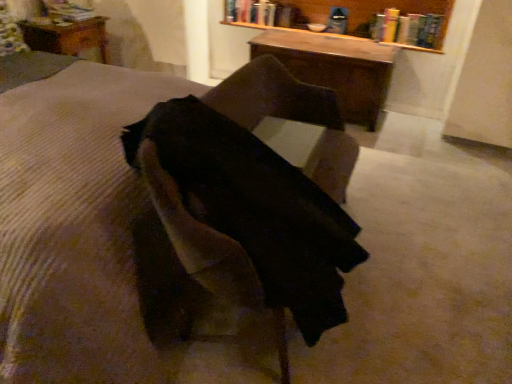
You are a GUI agent. You are given a task and a screenshot of the screen. Output one action in this format:
    pyautogui.click(x=<x>, y=<y>)
    Task: Click on the black fabric at center, the 2th table viewed from the left
    The width and height of the screenshot is (512, 384).
    Given the screenshot: What is the action you would take?
    pyautogui.click(x=313, y=152)

This screenshot has width=512, height=384. What do you see at coordinates (313, 152) in the screenshot?
I see `black fabric at center, acting as the 2th table starting from the right` at bounding box center [313, 152].

What do you see at coordinates (335, 68) in the screenshot?
I see `wooden table at center, which is the 2th table in front-to-back order` at bounding box center [335, 68].

This screenshot has height=384, width=512. Find the location of `hardcover book at upper left, placed as the first book when sorted from left to right`. hardcover book at upper left, placed as the first book when sorted from left to right is located at coordinates (67, 12).

The width and height of the screenshot is (512, 384). I want to click on hardcover book at upper center, which is counted as the first book, starting from the right, so click(x=409, y=28).

This screenshot has width=512, height=384. What do you see at coordinates (261, 13) in the screenshot?
I see `hardcover book at upper center, arranged as the 2th book when viewed from the right` at bounding box center [261, 13].

Locate an element on the screen. Image resolution: width=512 pixels, height=384 pixels. black fabric at center, acting as the 2th table starting from the right is located at coordinates (313, 152).

Considering the sizes of objects wooden table at upper left, acting as the 3th table starting from the front, and hardcover book at upper center, which is counted as the first book, starting from the right, in the image provided, who is taller, wooden table at upper left, acting as the 3th table starting from the front, or hardcover book at upper center, which is counted as the first book, starting from the right,?

wooden table at upper left, acting as the 3th table starting from the front, is taller.

From a real-world perspective, between wooden table at upper left, acting as the 3th table starting from the front, and hardcover book at upper center, the third book in the left-to-right sequence, who is vertically higher?

hardcover book at upper center, the third book in the left-to-right sequence, is physically above.

Could hardcover book at upper center, the third book in the left-to-right sequence, be considered to be inside wooden table at upper left, which appears as the first table when viewed from the left?

Actually, hardcover book at upper center, the third book in the left-to-right sequence, is outside wooden table at upper left, which appears as the first table when viewed from the left.

Does wooden table at upper left, marked as the 3th table in a right-to-left arrangement, lie in front of hardcover book at upper center, the third book in the left-to-right sequence?

Yes, wooden table at upper left, marked as the 3th table in a right-to-left arrangement, is closer to the viewer.

This screenshot has width=512, height=384. What are the coordinates of `table that is the 2nd one when counting backward from the brown corduroy mattress at center` in the screenshot? It's located at (335, 68).

Is brown corduroy mattress at center bigger or smaller than wooden table at center, which is counted as the 3th table, starting from the left?

Clearly, brown corduroy mattress at center is larger in size than wooden table at center, which is counted as the 3th table, starting from the left.

Does point (41, 202) appear closer or farther from the camera than point (283, 64)?

Point (41, 202) is positioned closer to the camera compared to point (283, 64).

Would you say brown corduroy mattress at center contains wooden table at center, which is the 2th table in front-to-back order?

No, wooden table at center, which is the 2th table in front-to-back order, is not a part of brown corduroy mattress at center.

Which of these two, wooden table at center, positioned as the 1th table in right-to-left order, or brown corduroy mattress at center, is bigger?

brown corduroy mattress at center.

Could brown corduroy mattress at center be considered to be inside wooden table at center, which is the 2th table in front-to-back order?

No, brown corduroy mattress at center is located outside of wooden table at center, which is the 2th table in front-to-back order.

Consider the image. From a real-world perspective, is wooden table at center, marked as the 2th table in a back-to-front arrangement, beneath brown corduroy mattress at center?

Yes, from a real-world perspective, wooden table at center, marked as the 2th table in a back-to-front arrangement, is beneath brown corduroy mattress at center.

Considering the points (32, 170) and (325, 133), which point is in front, point (32, 170) or point (325, 133)?

Point (32, 170)

Considering the relative sizes of brown corduroy mattress at center and black fabric at center, the 1th table in the front-to-back sequence, in the image provided, is brown corduroy mattress at center wider than black fabric at center, the 1th table in the front-to-back sequence,?

Indeed, brown corduroy mattress at center has a greater width compared to black fabric at center, the 1th table in the front-to-back sequence.

Consider the image. What's the angular difference between brown corduroy mattress at center and black fabric at center, arranged as the 3th table when viewed from the back,'s facing directions?

2.82 degrees separate the facing orientations of brown corduroy mattress at center and black fabric at center, arranged as the 3th table when viewed from the back.

Does brown corduroy mattress at center touch black fabric at center, acting as the 2th table starting from the right?

brown corduroy mattress at center and black fabric at center, acting as the 2th table starting from the right, are not in contact.

Is suede-like brown chair at center next to hardcover book at upper left, placed as the first book when sorted from left to right, and touching it?

No, suede-like brown chair at center is not in contact with hardcover book at upper left, placed as the first book when sorted from left to right.

Considering the sizes of objects suede-like brown chair at center and hardcover book at upper left, which is the third book in right-to-left order, in the image provided, who is thinner, suede-like brown chair at center or hardcover book at upper left, which is the third book in right-to-left order,?

hardcover book at upper left, which is the third book in right-to-left order.

Considering the positions of objects suede-like brown chair at center and hardcover book at upper left, placed as the first book when sorted from left to right, in the image provided, who is behind, suede-like brown chair at center or hardcover book at upper left, placed as the first book when sorted from left to right,?

hardcover book at upper left, placed as the first book when sorted from left to right, is more distant.

Looking at the image, does suede-like brown chair at center seem bigger or smaller compared to hardcover book at upper left, which is the third book in right-to-left order?

Considering their sizes, suede-like brown chair at center takes up more space than hardcover book at upper left, which is the third book in right-to-left order.

Does point (373, 76) come behind point (52, 6)?

That is False.

Considering the relative positions of wooden table at center, which is counted as the 3th table, starting from the left, and hardcover book at upper left, placed as the first book when sorted from left to right, in the image provided, is wooden table at center, which is counted as the 3th table, starting from the left, to the left or to the right of hardcover book at upper left, placed as the first book when sorted from left to right,?

From the image, it's evident that wooden table at center, which is counted as the 3th table, starting from the left, is to the right of hardcover book at upper left, placed as the first book when sorted from left to right.

Are wooden table at center, which is counted as the 3th table, starting from the left, and hardcover book at upper left, placed as the first book when sorted from left to right, located far from each other?

Indeed, wooden table at center, which is counted as the 3th table, starting from the left, is not near hardcover book at upper left, placed as the first book when sorted from left to right.

Looking at this image, is wooden table at center, which is counted as the 3th table, starting from the left, positioned with its back to hardcover book at upper left, placed as the first book when sorted from left to right?

That's not correct — wooden table at center, which is counted as the 3th table, starting from the left, is not looking away from hardcover book at upper left, placed as the first book when sorted from left to right.

Could you tell me if wooden bookshelf at upper center is turned towards wooden table at upper left, marked as the 3th table in a right-to-left arrangement?

No, wooden bookshelf at upper center is not aimed at wooden table at upper left, marked as the 3th table in a right-to-left arrangement.

How many degrees apart are the facing directions of wooden bookshelf at upper center and wooden table at upper left, acting as the 3th table starting from the front?

The facing directions of wooden bookshelf at upper center and wooden table at upper left, acting as the 3th table starting from the front, are 86.5 degrees apart.

Consider the image. Considering the positions of objects wooden bookshelf at upper center and wooden table at upper left, the first table from the back, in the image provided, who is more to the left, wooden bookshelf at upper center or wooden table at upper left, the first table from the back,?

From the viewer's perspective, wooden table at upper left, the first table from the back, appears more on the left side.

In the scene shown: Between wooden bookshelf at upper center and wooden table at upper left, the first table from the back, which one has smaller size?

wooden table at upper left, the first table from the back, is smaller.

This screenshot has width=512, height=384. What are the coordinates of `the 3rd book counting from the right side of the wooden table at upper left, the first table from the back` in the screenshot? It's located at (409, 28).

Locate an element on the screen. The image size is (512, 384). the 2nd table behind the brown corduroy mattress at center is located at coordinates (335, 68).

Estimate the real-world distances between objects in this image. Which object is closer to wooden table at center, which is the 2th table in front-to-back order, brown corduroy mattress at center or wooden bookshelf at upper center?

Based on the image, wooden bookshelf at upper center appears to be nearer to wooden table at center, which is the 2th table in front-to-back order.

Looking at the image, which one is located further to suede-like brown chair at center, black fabric at center, the 2th table viewed from the left, or wooden bookshelf at upper center?

Among the two, wooden bookshelf at upper center is located further to suede-like brown chair at center.

Considering their positions, is wooden bookshelf at upper center positioned closer to suede-like brown chair at center than brown corduroy mattress at center?

Based on the image, brown corduroy mattress at center appears to be nearer to suede-like brown chair at center.

Based on their spatial positions, is hardcover book at upper left, placed as the first book when sorted from left to right, or wooden bookshelf at upper center further from wooden table at upper left, which appears as the first table when viewed from the left?

Among the two, wooden bookshelf at upper center is located further to wooden table at upper left, which appears as the first table when viewed from the left.

Estimate the real-world distances between objects in this image. Which object is closer to hardcover book at upper center, arranged as the 2th book when viewed from the right, wooden bookshelf at upper center or suede-like brown chair at center?

wooden bookshelf at upper center is positioned closer to the anchor hardcover book at upper center, arranged as the 2th book when viewed from the right.

Based on their spatial positions, is wooden bookshelf at upper center or hardcover book at upper left, placed as the first book when sorted from left to right, further from suede-like brown chair at center?

The object further to suede-like brown chair at center is hardcover book at upper left, placed as the first book when sorted from left to right.

Which object lies nearer to the anchor point black fabric at center, the 2th table viewed from the left, hardcover book at upper left, placed as the first book when sorted from left to right, or wooden table at center, positioned as the 1th table in right-to-left order?

The object closer to black fabric at center, the 2th table viewed from the left, is wooden table at center, positioned as the 1th table in right-to-left order.

Considering their positions, is black fabric at center, acting as the 2th table starting from the right, positioned further to hardcover book at upper center, which is counted as the first book, starting from the right, than hardcover book at upper left, placed as the first book when sorted from left to right?

Among the two, hardcover book at upper left, placed as the first book when sorted from left to right, is located further to hardcover book at upper center, which is counted as the first book, starting from the right.

This screenshot has height=384, width=512. I want to click on chair between brown corduroy mattress at center and hardcover book at upper left, which is the third book in right-to-left order, from front to back, so click(240, 207).

Image resolution: width=512 pixels, height=384 pixels. Find the location of `bookcase between suede-like brown chair at center and hardcover book at upper center, which is counted as the first book, starting from the right, in the front-back direction`. bookcase between suede-like brown chair at center and hardcover book at upper center, which is counted as the first book, starting from the right, in the front-back direction is located at coordinates (385, 5).

The width and height of the screenshot is (512, 384). I want to click on chair located between brown corduroy mattress at center and wooden bookshelf at upper center in the depth direction, so click(x=240, y=207).

Find the location of a particular element. The width and height of the screenshot is (512, 384). chair positioned between brown corduroy mattress at center and wooden table at upper left, acting as the 3th table starting from the front, from near to far is located at coordinates (240, 207).